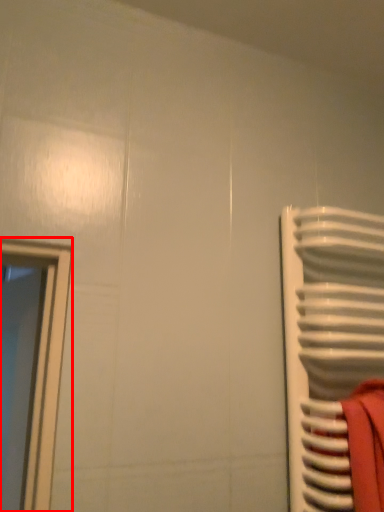
Question: From the image's perspective, what is the correct spatial relationship of window (annotated by the red box) in relation to radiator?

Choices:
 (A) above
 (B) below

Answer: (A)